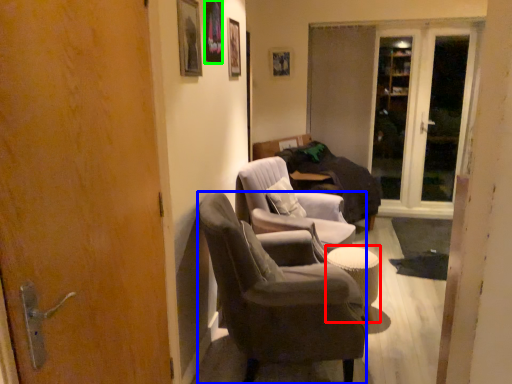
Question: Which object is the farthest from table (highlighted by a red box)? Choose among these: chair (highlighted by a blue box) or picture frame (highlighted by a green box).

Choices:
 (A) chair
 (B) picture frame

Answer: (B)